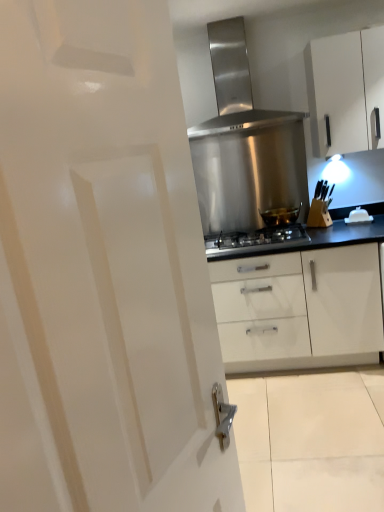
Question: Do you think white glossy cabinet at upper right is within shiny metallic pot at center, or outside of it?

Choices:
 (A) inside
 (B) outside

Answer: (B)

Question: Is point (306, 46) closer or farther from the camera than point (286, 219)?

Choices:
 (A) farther
 (B) closer

Answer: (B)

Question: Estimate the real-world distances between objects in this image. Which object is farther from the white glossy door at center?

Choices:
 (A) stainless steel range hood at upper center
 (B) shiny metallic pot at center
 (C) stainless steel gas stove at center
 (D) white glossy cabinet at upper right
 (E) white glossy kettle at upper right

Answer: (E)

Question: Considering the real-world distances, which object is farthest from the white glossy kettle at upper right?

Choices:
 (A) white glossy door at center
 (B) white glossy cabinet at upper right
 (C) stainless steel range hood at upper center
 (D) stainless steel gas stove at center
 (E) shiny metallic pot at center

Answer: (A)